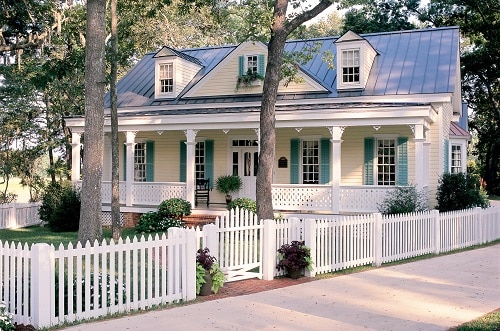
This screenshot has height=331, width=500. Identify the location of window box. (255, 81).